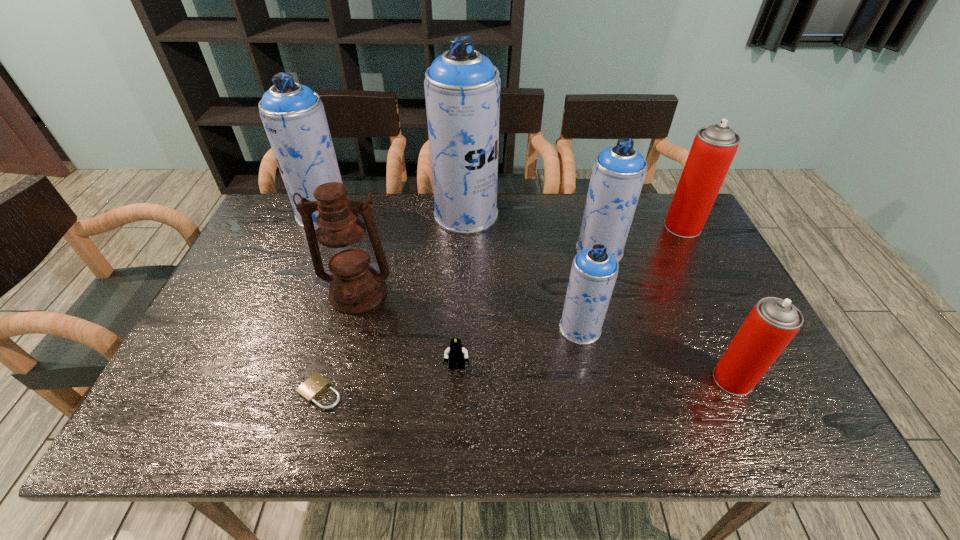
This screenshot has width=960, height=540. I want to click on the second blue aerosol can from left to right, so click(x=462, y=87).

Locate an element on the screen. the tallest object is located at coordinates (462, 87).

Where is `the second biggest blue aerosol can`? the second biggest blue aerosol can is located at coordinates (293, 115).

Where is `the leftmost blue aerosol can`? The height and width of the screenshot is (540, 960). the leftmost blue aerosol can is located at coordinates (293, 115).

Locate an element on the screen. This screenshot has height=540, width=960. the bigger red aerosol can is located at coordinates (714, 147).

Locate an element on the screen. the third biggest blue aerosol can is located at coordinates (618, 173).

In order to click on oil lamp in this screenshot , I will do (355, 287).

Locate an element on the screen. the nearer red aerosol can is located at coordinates (773, 322).

What are the coordinates of `the nearest aerosol can` in the screenshot? It's located at (773, 322).

Identify the location of the nearest blue aerosol can. This screenshot has width=960, height=540. click(594, 271).